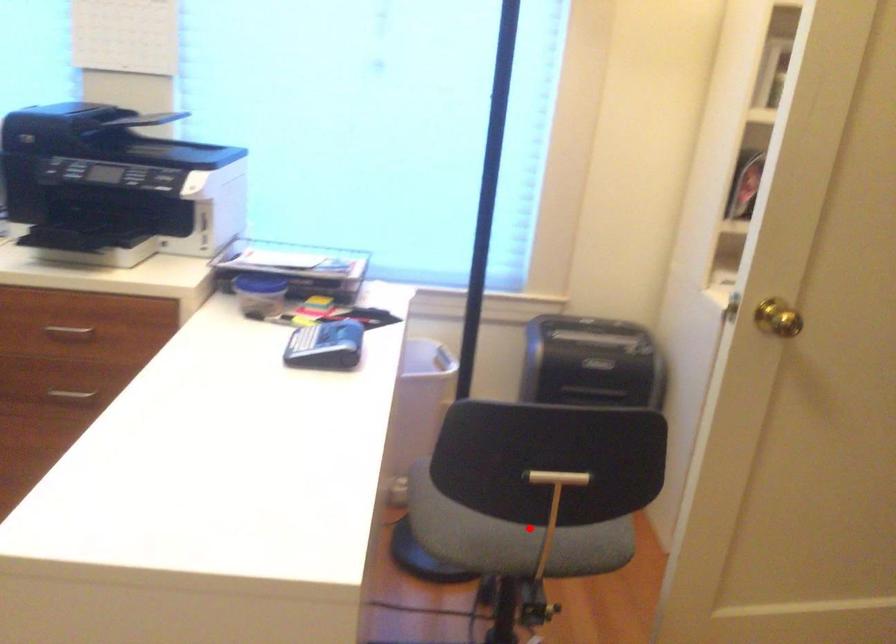
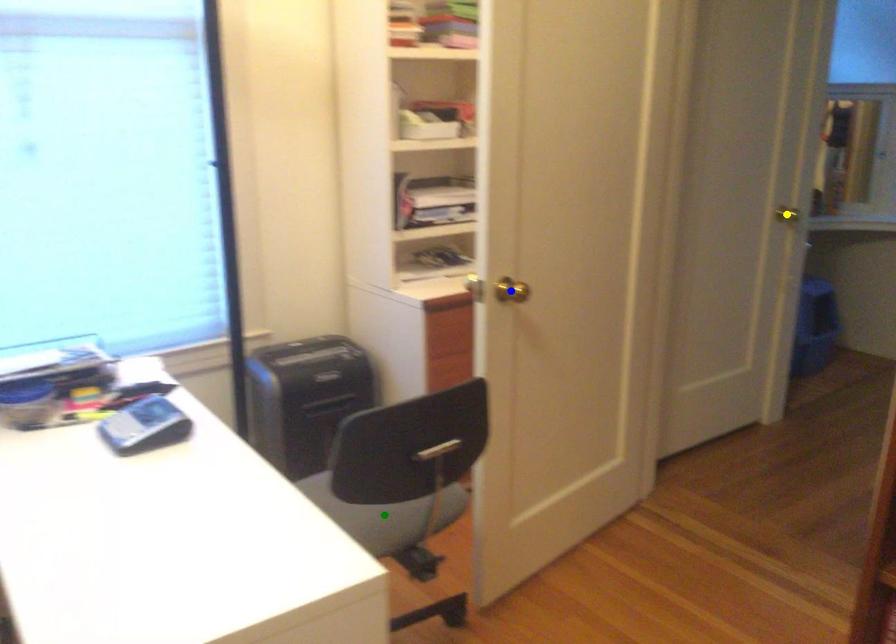
Question: I am providing you with two images of the same scene from different viewpoints. A red point is marked on the first image. You are given multiple points on the second image. In image 2, which mark is for the same physical point as the one in image 1?

Choices:
 (A) yellow point
 (B) blue point
 (C) green point

Answer: (C)